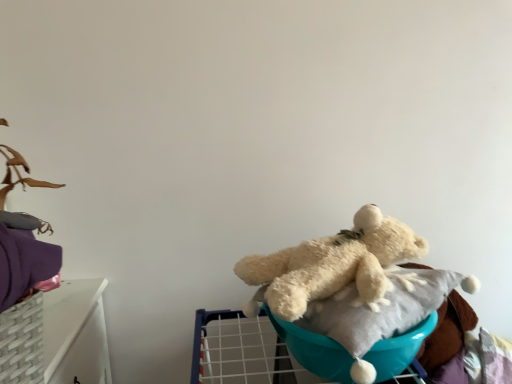
Question: Is fluffy white teddy bear at center located outside white plush bear at center?

Choices:
 (A) no
 (B) yes

Answer: (B)

Question: Would you say fluffy white teddy bear at center contains white plush bear at center?

Choices:
 (A) yes
 (B) no

Answer: (B)

Question: Is fluffy white teddy bear at center wider than white plush bear at center?

Choices:
 (A) no
 (B) yes

Answer: (B)

Question: Does fluffy white teddy bear at center have a lesser width compared to white plush bear at center?

Choices:
 (A) yes
 (B) no

Answer: (B)

Question: Does fluffy white teddy bear at center have a greater height compared to white plush bear at center?

Choices:
 (A) yes
 (B) no

Answer: (A)

Question: Is there a large distance between fluffy white teddy bear at center and white plush bear at center?

Choices:
 (A) no
 (B) yes

Answer: (A)

Question: Can you confirm if white plush bear at center is thinner than fluffy white teddy bear at center?

Choices:
 (A) no
 (B) yes

Answer: (B)

Question: Does white plush bear at center have a lesser height compared to fluffy white teddy bear at center?

Choices:
 (A) yes
 (B) no

Answer: (A)

Question: From a real-world perspective, does white plush bear at center stand above fluffy white teddy bear at center?

Choices:
 (A) no
 (B) yes

Answer: (A)

Question: Is white plush bear at center oriented away from fluffy white teddy bear at center?

Choices:
 (A) yes
 (B) no

Answer: (B)

Question: Is white plush bear at center positioned before fluffy white teddy bear at center?

Choices:
 (A) yes
 (B) no

Answer: (A)

Question: Is fluffy white teddy bear at center located within white plush bear at center?

Choices:
 (A) yes
 (B) no

Answer: (B)

Question: From a real-world perspective, is fluffy white teddy bear at center above or below white plush bear at center?

Choices:
 (A) below
 (B) above

Answer: (B)